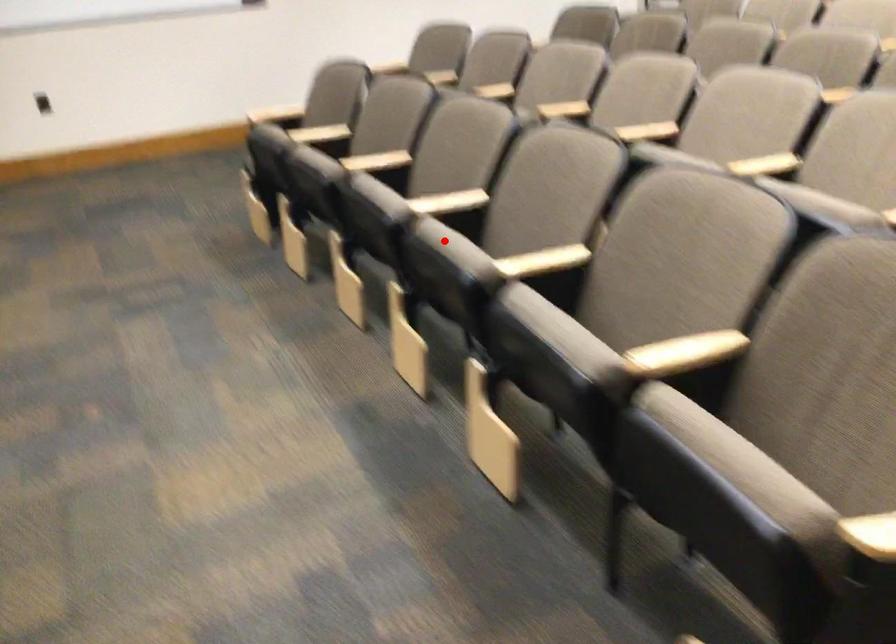
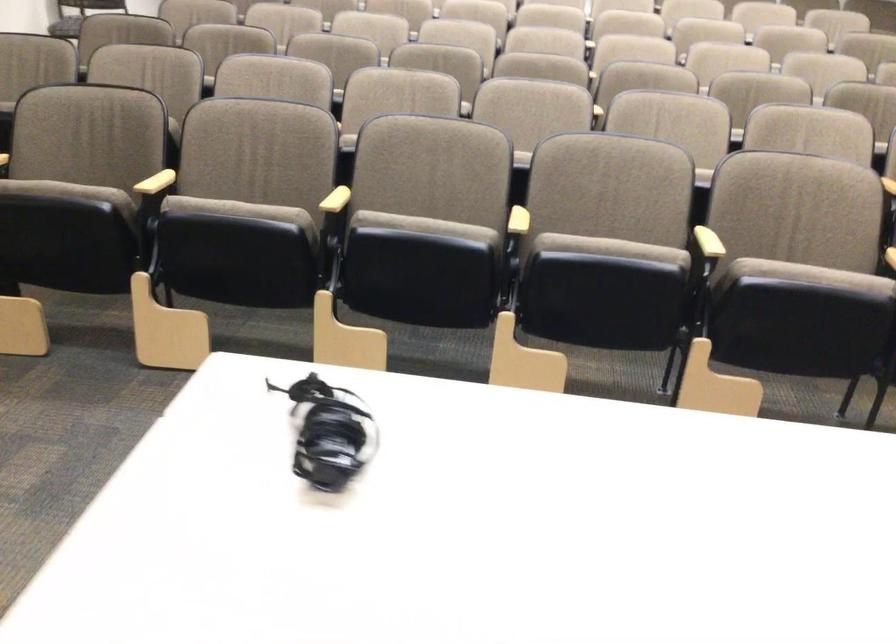
The point at the highlighted location is marked in the first image. Where is the corresponding point in the second image?

(610, 249)